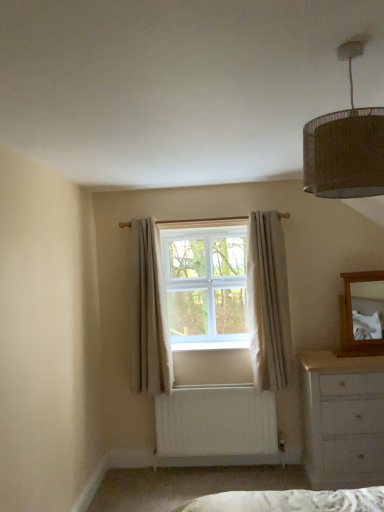
I want to click on white painted wood chest of drawers at lower right, so click(342, 419).

This screenshot has height=512, width=384. What do you see at coordinates (342, 419) in the screenshot?
I see `white painted wood chest of drawers at lower right` at bounding box center [342, 419].

The image size is (384, 512). Describe the element at coordinates (205, 286) in the screenshot. I see `white plastic window at center` at that location.

Measure the distance between point (138, 314) and camera.

A distance of 3.34 meters exists between point (138, 314) and camera.

This screenshot has height=512, width=384. What do you see at coordinates (362, 314) in the screenshot?
I see `wooden mirror at right` at bounding box center [362, 314].

Image resolution: width=384 pixels, height=512 pixels. What do you see at coordinates (268, 302) in the screenshot?
I see `white textured curtain at center, which is counted as the 2th curtain, starting from the left` at bounding box center [268, 302].

I want to click on white painted wood chest of drawers at lower right, so click(342, 419).

Which object is wider, wooden mirror at right or white painted wood chest of drawers at lower right?

white painted wood chest of drawers at lower right is wider.

In the scene shown: Is wooden mirror at right directly adjacent to white painted wood chest of drawers at lower right?

wooden mirror at right and white painted wood chest of drawers at lower right are not in contact.

From a real-world perspective, is wooden mirror at right positioned over white painted wood chest of drawers at lower right based on gravity?

Yes.

Considering the sizes of objects white textured curtain at center, the first curtain viewed from the right, and wooden mirror at right in the image provided, who is taller, white textured curtain at center, the first curtain viewed from the right, or wooden mirror at right?

Standing taller between the two is white textured curtain at center, the first curtain viewed from the right.

From a real-world perspective, is white textured curtain at center, which is counted as the 2th curtain, starting from the left, below wooden mirror at right?

No, from a real-world perspective, white textured curtain at center, which is counted as the 2th curtain, starting from the left, is not beneath wooden mirror at right.

Looking at this image, relative to wooden mirror at right, is white textured curtain at center, which is counted as the 2th curtain, starting from the left, in front or behind?

Clearly, white textured curtain at center, which is counted as the 2th curtain, starting from the left, is behind wooden mirror at right.

Is white textured curtain at center, the first curtain viewed from the right, touching wooden mirror at right?

white textured curtain at center, the first curtain viewed from the right, is not next to wooden mirror at right, and they're not touching.

Is light beige fabric curtain at center, acting as the second curtain starting from the right, touching white painted wood chest of drawers at lower right?

No, light beige fabric curtain at center, acting as the second curtain starting from the right, is not in contact with white painted wood chest of drawers at lower right.

From a real-world perspective, which curtain is the 1st one above the white painted wood chest of drawers at lower right? Please provide its 2D coordinates.

[(148, 314)]

Is point (137, 383) positioned before point (382, 467)?

No, (137, 383) is behind (382, 467).

In terms of height, does light beige fabric curtain at center, positioned as the 1th curtain in left-to-right order, look taller or shorter compared to white painted wood chest of drawers at lower right?

In the image, light beige fabric curtain at center, positioned as the 1th curtain in left-to-right order, appears to be taller than white painted wood chest of drawers at lower right.

Considering the positions of objects wooden mirror at right and white plastic window at center in the image provided, who is more to the left, wooden mirror at right or white plastic window at center?

white plastic window at center.

Is wooden mirror at right turned away from white plastic window at center?

wooden mirror at right does not have its back to white plastic window at center.

What's the angular difference between wooden mirror at right and white plastic window at center's facing directions?

The angular difference between wooden mirror at right and white plastic window at center is 0.896 degrees.

Is point (369, 320) behind point (244, 271)?

That is False.

From the picture: From a real-world perspective, is light beige fabric curtain at center, acting as the second curtain starting from the right, physically above white textured curtain at center, which is counted as the 2th curtain, starting from the left?

No, from a real-world perspective, light beige fabric curtain at center, acting as the second curtain starting from the right, is not over white textured curtain at center, which is counted as the 2th curtain, starting from the left

Is light beige fabric curtain at center, acting as the second curtain starting from the right, shorter than white textured curtain at center, the first curtain viewed from the right?

No, light beige fabric curtain at center, acting as the second curtain starting from the right, is not shorter than white textured curtain at center, the first curtain viewed from the right.

In the scene shown: Is light beige fabric curtain at center, positioned as the 1th curtain in left-to-right order, turned away from white textured curtain at center, the first curtain viewed from the right?

No, light beige fabric curtain at center, positioned as the 1th curtain in left-to-right order, is not facing the opposite direction of white textured curtain at center, the first curtain viewed from the right.

In the scene shown: Which is less distant, (146, 261) or (288, 326)?

Point (146, 261) is positioned closer to the camera compared to point (288, 326).

Which is more to the right, white painted wood chest of drawers at lower right or white textured curtain at center, which is counted as the 2th curtain, starting from the left?

white painted wood chest of drawers at lower right is more to the right.

Identify the location of chest of drawers below the white textured curtain at center, the first curtain viewed from the right (from a real-world perspective). The width and height of the screenshot is (384, 512). (342, 419).

Considering their positions, is white painted wood chest of drawers at lower right located in front of or behind white textured curtain at center, the first curtain viewed from the right?

In the image, white painted wood chest of drawers at lower right appears in front of white textured curtain at center, the first curtain viewed from the right.

Is light beige fabric curtain at center, positioned as the 1th curtain in left-to-right order, taller than wooden mirror at right?

Correct, light beige fabric curtain at center, positioned as the 1th curtain in left-to-right order, is much taller as wooden mirror at right.

Does light beige fabric curtain at center, positioned as the 1th curtain in left-to-right order, come behind wooden mirror at right?

Yes.

From a real-world perspective, is light beige fabric curtain at center, acting as the second curtain starting from the right, on wooden mirror at right?

Yes, from a real-world perspective, light beige fabric curtain at center, acting as the second curtain starting from the right, is on top of wooden mirror at right.

From the image's perspective, does light beige fabric curtain at center, positioned as the 1th curtain in left-to-right order, appear higher than wooden mirror at right?

Correct, light beige fabric curtain at center, positioned as the 1th curtain in left-to-right order, appears higher than wooden mirror at right in the image.

You are a GUI agent. You are given a task and a screenshot of the screen. Output one action in this format:
    pyautogui.click(x=<x>, y=<y>)
    Task: Click on the chest of drawers below the wooden mirror at right (from the image's perspective)
    This screenshot has height=512, width=384.
    Given the screenshot: What is the action you would take?
    pyautogui.click(x=342, y=419)

The height and width of the screenshot is (512, 384). Identify the location of the 2nd curtain above the wooden mirror at right (from the image's perspective). (268, 302).

Estimate the real-world distances between objects in this image. Which object is further from wooden mirror at right, braided wicker lampshade at upper right or white painted wood chest of drawers at lower right?

braided wicker lampshade at upper right is further to wooden mirror at right.

From the image, which object appears to be farther from light beige fabric curtain at center, positioned as the 1th curtain in left-to-right order, white plastic window at center or braided wicker lampshade at upper right?

braided wicker lampshade at upper right is positioned further to the anchor light beige fabric curtain at center, positioned as the 1th curtain in left-to-right order.

Estimate the real-world distances between objects in this image. Which object is closer to white plastic window at center, white textured curtain at center, which is counted as the 2th curtain, starting from the left, or braided wicker lampshade at upper right?

Based on the image, white textured curtain at center, which is counted as the 2th curtain, starting from the left, appears to be nearer to white plastic window at center.

When comparing their distances from light beige fabric curtain at center, acting as the second curtain starting from the right, does white painted wood chest of drawers at lower right or white textured curtain at center, which is counted as the 2th curtain, starting from the left, seem closer?

white textured curtain at center, which is counted as the 2th curtain, starting from the left, is positioned closer to the anchor light beige fabric curtain at center, acting as the second curtain starting from the right.

When comparing their distances from braided wicker lampshade at upper right, does white plastic window at center or white textured curtain at center, which is counted as the 2th curtain, starting from the left, seem closer?

The object closer to braided wicker lampshade at upper right is white textured curtain at center, which is counted as the 2th curtain, starting from the left.

Looking at the image, which one is located closer to light beige fabric curtain at center, acting as the second curtain starting from the right, white textured curtain at center, the first curtain viewed from the right, or wooden mirror at right?

white textured curtain at center, the first curtain viewed from the right, is closer to light beige fabric curtain at center, acting as the second curtain starting from the right.

From the image, which object appears to be farther from braided wicker lampshade at upper right, light beige fabric curtain at center, acting as the second curtain starting from the right, or wooden mirror at right?

light beige fabric curtain at center, acting as the second curtain starting from the right, is positioned further to the anchor braided wicker lampshade at upper right.

Estimate the real-world distances between objects in this image. Which object is closer to light beige fabric curtain at center, positioned as the 1th curtain in left-to-right order, white textured curtain at center, which is counted as the 2th curtain, starting from the left, or white plastic window at center?

white plastic window at center lies closer to light beige fabric curtain at center, positioned as the 1th curtain in left-to-right order, than the other object.

You are a GUI agent. You are given a task and a screenshot of the screen. Output one action in this format:
    pyautogui.click(x=<x>, y=<y>)
    Task: Click on the mirror between braided wicker lampshade at upper right and light beige fabric curtain at center, positioned as the 1th curtain in left-to-right order, from front to back
    This screenshot has height=512, width=384.
    Given the screenshot: What is the action you would take?
    pyautogui.click(x=362, y=314)

At what (x,y) coordinates should I click in order to perform the action: click on chest of drawers between light beige fabric curtain at center, positioned as the 1th curtain in left-to-right order, and wooden mirror at right. Please return your answer as a coordinate pair (x, y). The width and height of the screenshot is (384, 512). Looking at the image, I should click on pyautogui.click(x=342, y=419).

Find the location of a particular element. The height and width of the screenshot is (512, 384). curtain between white plastic window at center and wooden mirror at right is located at coordinates (268, 302).

Find the location of `chest of drawers between braided wicker lampshade at upper right and light beige fabric curtain at center, positioned as the 1th curtain in left-to-right order, in the front-back direction`. chest of drawers between braided wicker lampshade at upper right and light beige fabric curtain at center, positioned as the 1th curtain in left-to-right order, in the front-back direction is located at coordinates (342, 419).